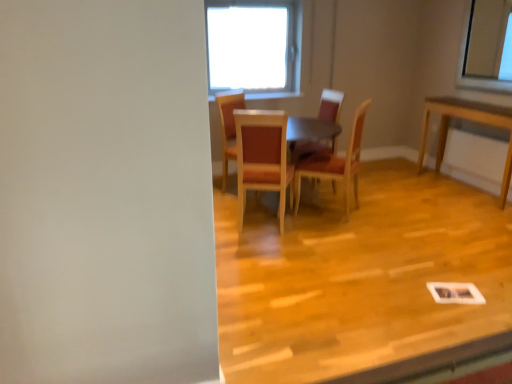
Question: Is wooden floor at center completely or partially outside of wooden chair at center, the first chair in the right-to-left sequence?

Choices:
 (A) yes
 (B) no

Answer: (A)

Question: Is wooden floor at center at the right side of wooden chair at center, the fourth chair when ordered from left to right?

Choices:
 (A) yes
 (B) no

Answer: (A)

Question: Considering the relative sizes of wooden floor at center and wooden chair at center, the fourth chair when ordered from left to right, in the image provided, is wooden floor at center taller than wooden chair at center, the fourth chair when ordered from left to right,?

Choices:
 (A) yes
 (B) no

Answer: (B)

Question: Is wooden floor at center beside wooden chair at center, the first chair in the right-to-left sequence?

Choices:
 (A) no
 (B) yes

Answer: (A)

Question: Is wooden floor at center behind wooden chair at center, the fourth chair when ordered from left to right?

Choices:
 (A) no
 (B) yes

Answer: (A)

Question: Does wooden floor at center have a larger size compared to wooden chair at center, the first chair in the right-to-left sequence?

Choices:
 (A) yes
 (B) no

Answer: (A)

Question: Is wooden chair at center, which appears as the third chair when viewed from the left, oriented away from wooden chair at center, marked as the first chair in a left-to-right arrangement?

Choices:
 (A) no
 (B) yes

Answer: (A)

Question: From a real-world perspective, is wooden chair at center, which appears as the third chair when viewed from the left, physically above wooden chair at center, acting as the fourth chair starting from the right?

Choices:
 (A) yes
 (B) no

Answer: (A)

Question: Is wooden chair at center, the 2th chair positioned from the right, in contact with wooden chair at center, acting as the fourth chair starting from the right?

Choices:
 (A) yes
 (B) no

Answer: (B)

Question: Would you say wooden chair at center, which appears as the third chair when viewed from the left, is a long distance from wooden chair at center, marked as the first chair in a left-to-right arrangement?

Choices:
 (A) yes
 (B) no

Answer: (A)

Question: From the image's perspective, is wooden chair at center, which appears as the third chair when viewed from the left, over wooden chair at center, marked as the first chair in a left-to-right arrangement?

Choices:
 (A) yes
 (B) no

Answer: (A)

Question: Could you tell me if wooden chair at center, the 2th chair positioned from the right, is facing wooden chair at center, marked as the first chair in a left-to-right arrangement?

Choices:
 (A) no
 (B) yes

Answer: (B)

Question: Would you say wooden floor at center is part of wooden chair at center, positioned as the second chair in left-to-right order,'s contents?

Choices:
 (A) no
 (B) yes

Answer: (A)